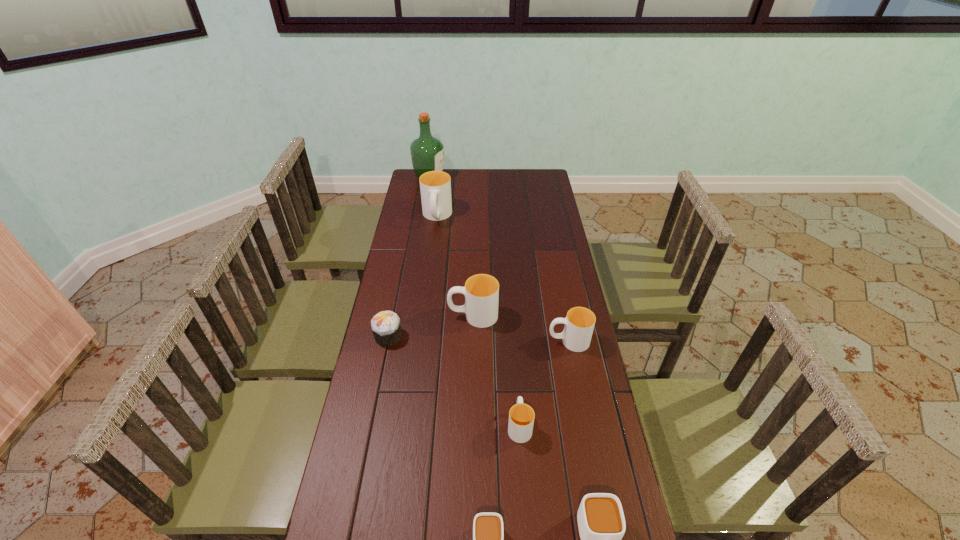
In order to click on cup that is the fifth closest to the cupcake in this screenshot , I will do `click(488, 532)`.

The image size is (960, 540). I want to click on yellow cup identified as the closest to the liquor, so click(435, 186).

Identify which yellow cup is the second nearest to the second smallest yellow cup. Please provide its 2D coordinates. Your answer should be formatted as a tuple, i.e. [(x, y)], where the tuple contains the x and y coordinates of a point satisfying the conditions above.

[(521, 416)]

Image resolution: width=960 pixels, height=540 pixels. Find the location of `free space that satisfies the following two spatial constraints: 1. on the front-facing side of the green liquor; 2. with the handle on the side of the fourth nearest cup`. free space that satisfies the following two spatial constraints: 1. on the front-facing side of the green liquor; 2. with the handle on the side of the fourth nearest cup is located at coordinates (401, 341).

Identify the location of vacant point that satisfies the following two spatial constraints: 1. with the handle on the side of the second smallest yellow cup; 2. on the front side of the cupcake. The width and height of the screenshot is (960, 540). coord(567,336).

In order to click on vacant space that satisfies the following two spatial constraints: 1. on the front-facing side of the tallest object; 2. with the handle on the side of the nearest yellow cup in this screenshot , I will do `click(387, 426)`.

Identify the location of vacant space that satisfies the following two spatial constraints: 1. with the handle on the side of the fourth tallest object; 2. with the handle on the side of the second tallest object. Image resolution: width=960 pixels, height=540 pixels. (544, 217).

Identify the location of vacant area that satisfies the following two spatial constraints: 1. on the front-facing side of the farthest object; 2. with the handle on the side of the rightmost yellow cup. The width and height of the screenshot is (960, 540). (401, 341).

I want to click on vacant space that satisfies the following two spatial constraints: 1. with the handle on the side of the second yellow cup from left to right; 2. on the front-facing side of the tallest object, so click(x=475, y=178).